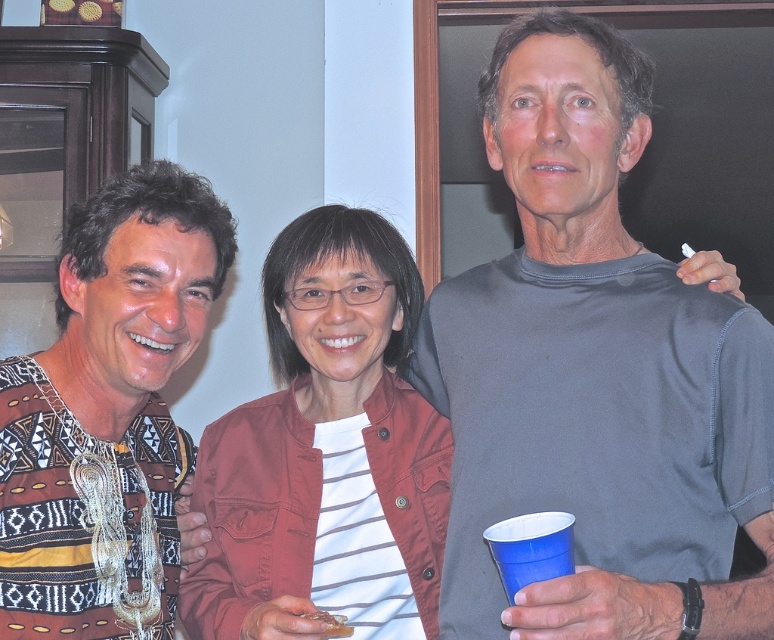
Between gray matte t-shirt at center and patterned fabric shirt at left, which one is positioned higher?

gray matte t-shirt at center is higher up.

Does gray matte t-shirt at center appear over patterned fabric shirt at left?

Indeed, gray matte t-shirt at center is positioned over patterned fabric shirt at left.

What are the coordinates of `gray matte t-shirt at center` in the screenshot? It's located at 594,372.

Is gray matte t-shirt at center in front of brown crumbly bread at lower center?

Yes, gray matte t-shirt at center is in front of brown crumbly bread at lower center.

Can you confirm if gray matte t-shirt at center is bigger than brown crumbly bread at lower center?

Yes.

Between point (526, 339) and point (326, 627), which one is positioned behind?

Positioned behind is point (526, 339).

Find the location of `gray matte t-shirt at center`. gray matte t-shirt at center is located at coordinates 594,372.

Can you confirm if gray matte t-shirt at center is shorter than denim jacket at center?

In fact, gray matte t-shirt at center may be taller than denim jacket at center.

Can you confirm if gray matte t-shirt at center is smaller than denim jacket at center?

Actually, gray matte t-shirt at center might be larger than denim jacket at center.

Is point (666, 500) positioned after point (197, 598)?

No, it is in front of (197, 598).

The image size is (774, 640). In order to click on gray matte t-shirt at center in this screenshot , I will do `click(594, 372)`.